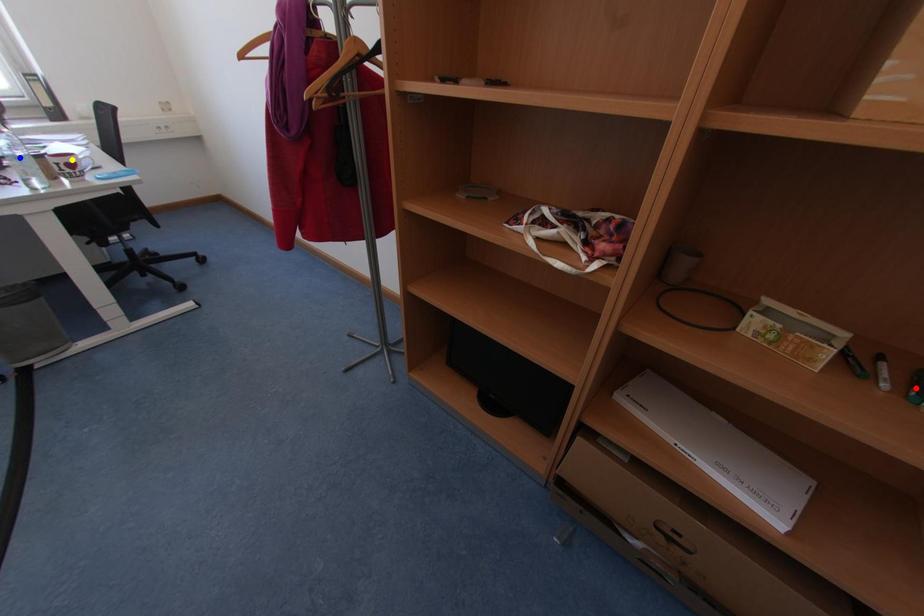
Order these from nearest to farthest:
blue point, yellow point, red point

yellow point → blue point → red point